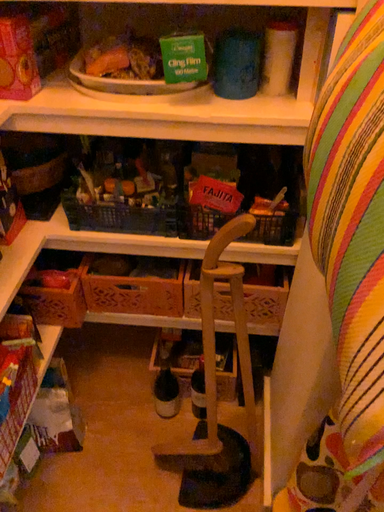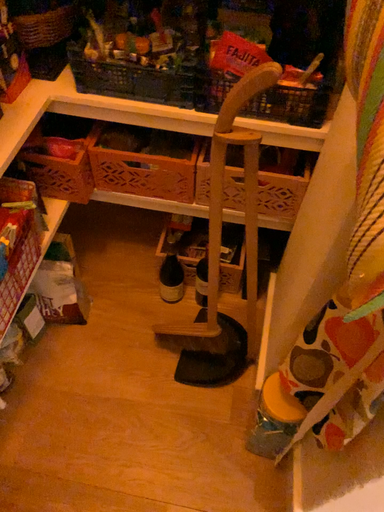
Question: How did the camera likely rotate when shooting the video?

Choices:
 (A) rotated downward
 (B) rotated upward

Answer: (A)